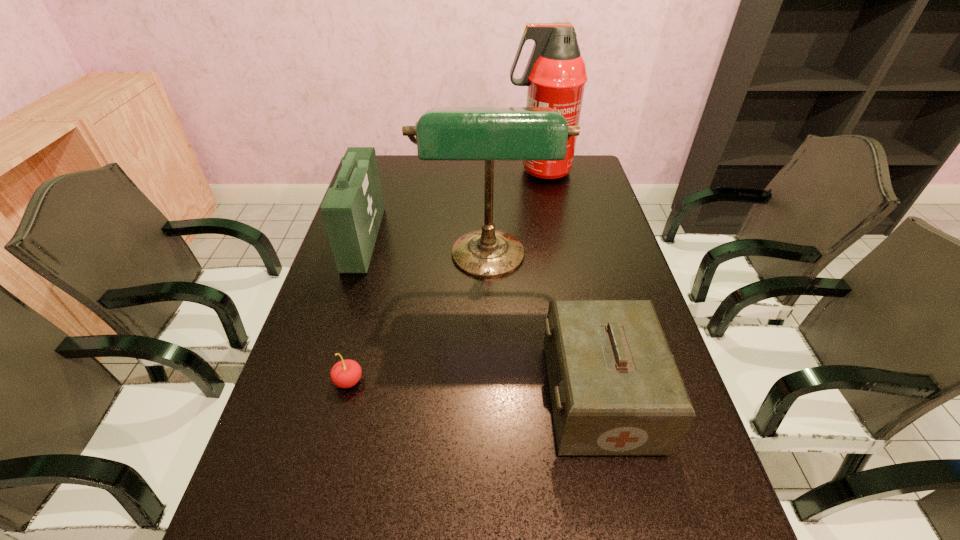
This screenshot has width=960, height=540. Identify the location of object identified as the third closest to the shortest object. (615, 389).

Locate which object ranks in proximity to the table lamp. Please provide its 2D coordinates. Your answer should be formatted as a tuple, i.e. [(x, y)], where the tuple contains the x and y coordinates of a point satisfying the conditions above.

[(352, 211)]

Where is `free space that satisfies the following two spatial constraints: 1. on the trigger side of the farthest object; 2. above the green lampshade of the table lamp`? Image resolution: width=960 pixels, height=540 pixels. free space that satisfies the following two spatial constraints: 1. on the trigger side of the farthest object; 2. above the green lampshade of the table lamp is located at coordinates (557, 261).

The width and height of the screenshot is (960, 540). In order to click on free point that satisfies the following two spatial constraints: 1. on the trigger side of the shorter first-aid kit; 2. on the left side of the fire extinguisher in this screenshot , I will do `click(584, 397)`.

Where is `free location that satisfies the following two spatial constraints: 1. on the front-facing side of the farther first-aid kit; 2. on the back side of the fourth tallest object`? The image size is (960, 540). free location that satisfies the following two spatial constraints: 1. on the front-facing side of the farther first-aid kit; 2. on the back side of the fourth tallest object is located at coordinates (315, 397).

I want to click on free point that satisfies the following two spatial constraints: 1. on the front-facing side of the left first-aid kit; 2. on the back side of the second shortest object, so click(x=315, y=397).

This screenshot has width=960, height=540. Identify the location of vacant region that satisfies the following two spatial constraints: 1. on the trigger side of the fire extinguisher; 2. above the green lampshade of the table lamp. (557, 261).